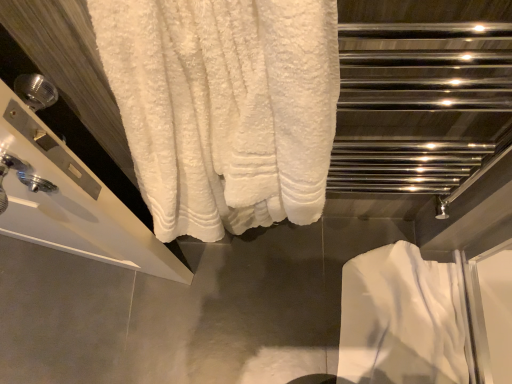
Question: Based on their sizes in the image, would you say white soft towel at lower right is bigger or smaller than white fluffy towel at upper left?

Choices:
 (A) small
 (B) big

Answer: (A)

Question: From a real-world perspective, is white soft towel at lower right physically located above or below white fluffy towel at upper left?

Choices:
 (A) below
 (B) above

Answer: (A)

Question: Considering the positions of white soft towel at lower right and white fluffy towel at upper left in the image, is white soft towel at lower right taller or shorter than white fluffy towel at upper left?

Choices:
 (A) tall
 (B) short

Answer: (B)

Question: Is point (322, 129) positioned closer to the camera than point (430, 274)?

Choices:
 (A) closer
 (B) farther

Answer: (A)

Question: From the image's perspective, is white fluffy towel at upper left positioned above or below white soft towel at lower right?

Choices:
 (A) below
 (B) above

Answer: (B)

Question: Choose the correct answer: Is white fluffy towel at upper left inside white soft towel at lower right or outside it?

Choices:
 (A) inside
 (B) outside

Answer: (B)

Question: From their relative heights in the image, would you say white fluffy towel at upper left is taller or shorter than white soft towel at lower right?

Choices:
 (A) short
 (B) tall

Answer: (B)